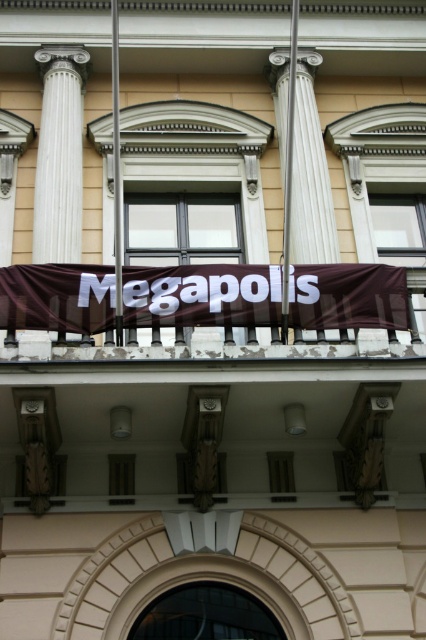
Which is more to the right, white marble column at left or metallic flagpole at upper center?

metallic flagpole at upper center

Does white marble column at left appear on the right side of metallic flagpole at upper center?

No, white marble column at left is not to the right of metallic flagpole at upper center.

Identify the location of white marble column at left. (60, 156).

The height and width of the screenshot is (640, 426). I want to click on white marble column at left, so click(60, 156).

Between white marble pillar at center and metallic flagpole at upper center, which one has more height?

metallic flagpole at upper center

Between point (284, 67) and point (115, 273), which one is positioned in front?

Positioned in front is point (115, 273).

The height and width of the screenshot is (640, 426). What do you see at coordinates (310, 176) in the screenshot? I see `white marble pillar at center` at bounding box center [310, 176].

Identify the location of white marble pillar at center. (310, 176).

Can you confirm if brown fabric banner at center is positioned to the left of white marble pillar at center?

Correct, you'll find brown fabric banner at center to the left of white marble pillar at center.

Who is more forward, (40, 269) or (298, 212)?

Positioned in front is point (40, 269).

This screenshot has width=426, height=640. I want to click on brown fabric banner at center, so click(201, 296).